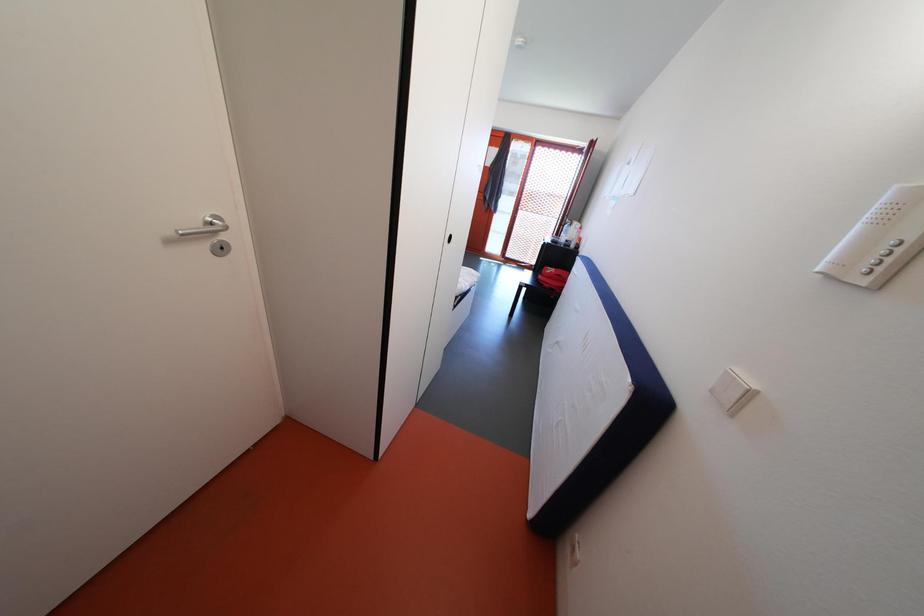
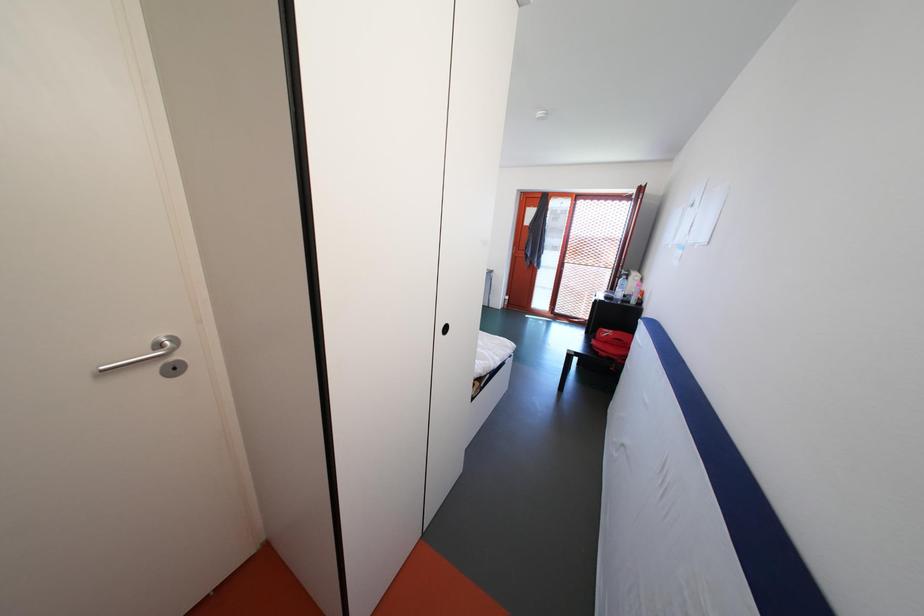
Question: The camera is either moving clockwise (left) or counter-clockwise (right) around the object. The first image is from the beginning of the video and the second image is from the end. Is the camera moving left or right when shooting the video?

Choices:
 (A) Left
 (B) Right

Answer: (B)